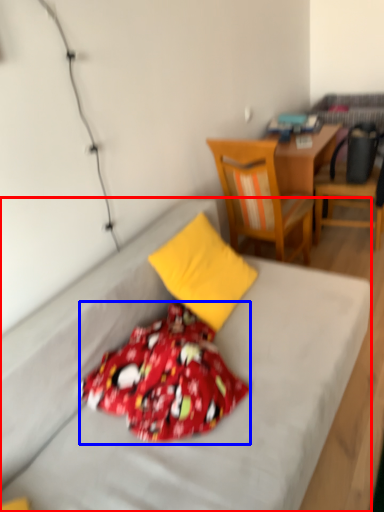
Question: Among these objects, which one is farthest to the camera, bed (highlighted by a red box) or blanket (highlighted by a blue box)?

Choices:
 (A) bed
 (B) blanket

Answer: (B)